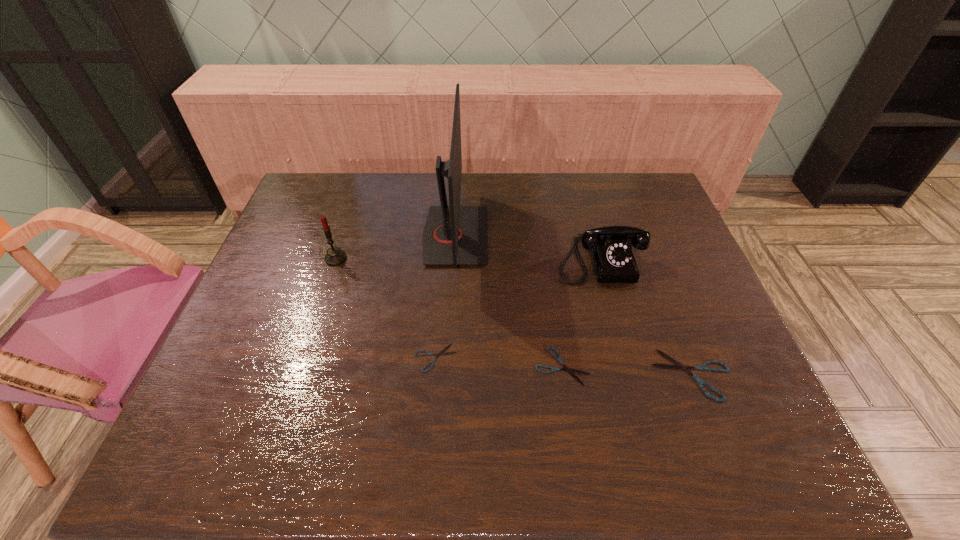
Where is `free space in the image that satisfies the following two spatial constraints: 1. on the front side of the leftmost shears; 2. on the right side of the tallest shears`? This screenshot has width=960, height=540. free space in the image that satisfies the following two spatial constraints: 1. on the front side of the leftmost shears; 2. on the right side of the tallest shears is located at coordinates (434, 375).

Find the location of a particular element. blank space that satisfies the following two spatial constraints: 1. on the front side of the third shortest object; 2. on the right side of the second tallest object is located at coordinates (298, 375).